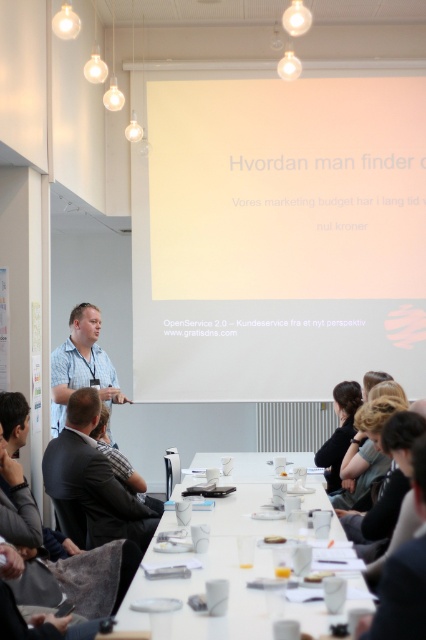
You are a photographer standing at the camera position in the room. You need to capture a photo of the white matte projector screen at upper center. Considering the distance between you and the screen, what is the minimum focal length required for your camera lens to ensure the entire screen is in focus without cropping?

The white matte projector screen at upper center is 20.77 feet away from the camera. To capture the entire screen without cropping, the minimum focal length required depends on the sensor size and field of view. However, a general guideline is to use a focal length that matches the sensor dimensions and distance to avoid distortion. For example, with a full frame sensor, a 50mm lens might be suitable, but precise calculation requires knowing the screen dimensions and sensor specifications.